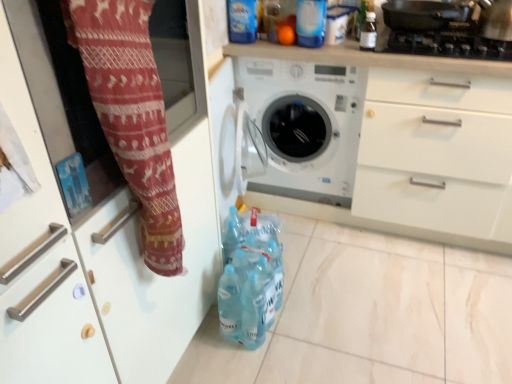
Question: Can you confirm if translucent plastic bottles at lower center, placed as the first bottle when sorted from bottom to top, is positioned to the right of red knit fabric at left?

Choices:
 (A) no
 (B) yes

Answer: (B)

Question: From a real-world perspective, is translucent plastic bottles at lower center, the second bottle from the top, on top of red knit fabric at left?

Choices:
 (A) yes
 (B) no

Answer: (B)

Question: Is translucent plastic bottles at lower center, the first bottle viewed from the left, touching red knit fabric at left?

Choices:
 (A) yes
 (B) no

Answer: (B)

Question: Would you say translucent plastic bottles at lower center, the first bottle viewed from the left, is outside red knit fabric at left?

Choices:
 (A) no
 (B) yes

Answer: (B)

Question: From the image's perspective, is translucent plastic bottles at lower center, the first bottle viewed from the left, located above red knit fabric at left?

Choices:
 (A) yes
 (B) no

Answer: (B)

Question: Does translucent plastic bottles at lower center, placed as the first bottle when sorted from bottom to top, have a greater width compared to red knit fabric at left?

Choices:
 (A) no
 (B) yes

Answer: (B)

Question: Can white plastic washing machine at center be found inside transparent plastic bottle at upper right, which is the 1th bottle from top to bottom?

Choices:
 (A) yes
 (B) no

Answer: (B)

Question: Is transparent plastic bottle at upper right, placed as the first bottle when sorted from right to left, closer to camera compared to white plastic washing machine at center?

Choices:
 (A) yes
 (B) no

Answer: (A)

Question: From the image's perspective, is transparent plastic bottle at upper right, placed as the first bottle when sorted from right to left, under white plastic washing machine at center?

Choices:
 (A) yes
 (B) no

Answer: (B)

Question: Is the surface of transparent plastic bottle at upper right, arranged as the 2th bottle when viewed from the left, in direct contact with white plastic washing machine at center?

Choices:
 (A) no
 (B) yes

Answer: (A)

Question: Considering the relative positions of transparent plastic bottle at upper right, arranged as the 2th bottle when viewed from the left, and white plastic washing machine at center in the image provided, is transparent plastic bottle at upper right, arranged as the 2th bottle when viewed from the left, behind white plastic washing machine at center?

Choices:
 (A) no
 (B) yes

Answer: (A)

Question: From a real-world perspective, is red knit fabric at left positioned under white plastic washing machine at center based on gravity?

Choices:
 (A) yes
 (B) no

Answer: (B)